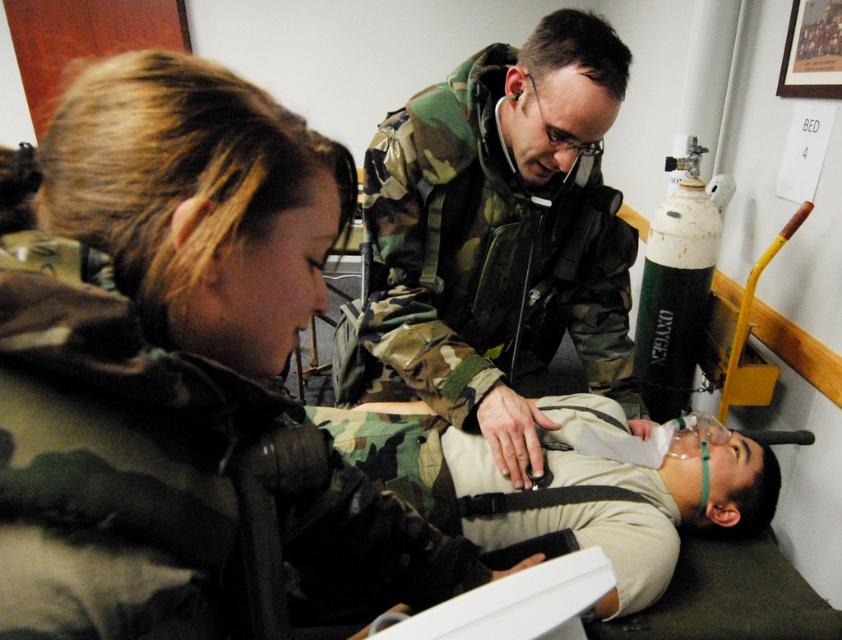
You are a medical trainee standing in the scene. You need to reach both the point at coordinates point (499,353) and point (513,579). Which point should you reach first to get to the closer one?

You should reach point (499,353) first because it is closer to you than point (513,579).